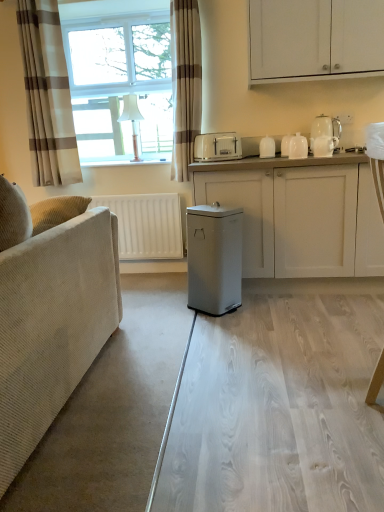
I want to click on vacant region to the left of metallic gray trash can at center, so click(x=173, y=309).